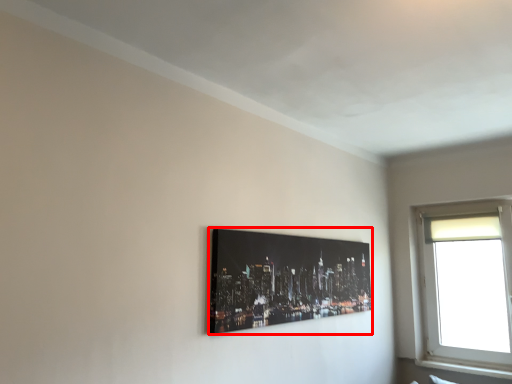
Question: In this image, where is picture frame (annotated by the red box) located relative to window?

Choices:
 (A) left
 (B) right

Answer: (A)